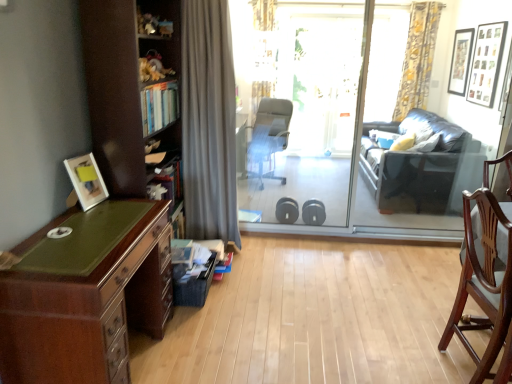
At what (x,y) coordinates should I click in order to perform the action: click on vacant area that is situated to the right of white glossy picture frame at left, which ranks as the 3th picture frame in back-to-front order. Please return your answer as a coordinate pair (x, y). The height and width of the screenshot is (384, 512). Looking at the image, I should click on (112, 201).